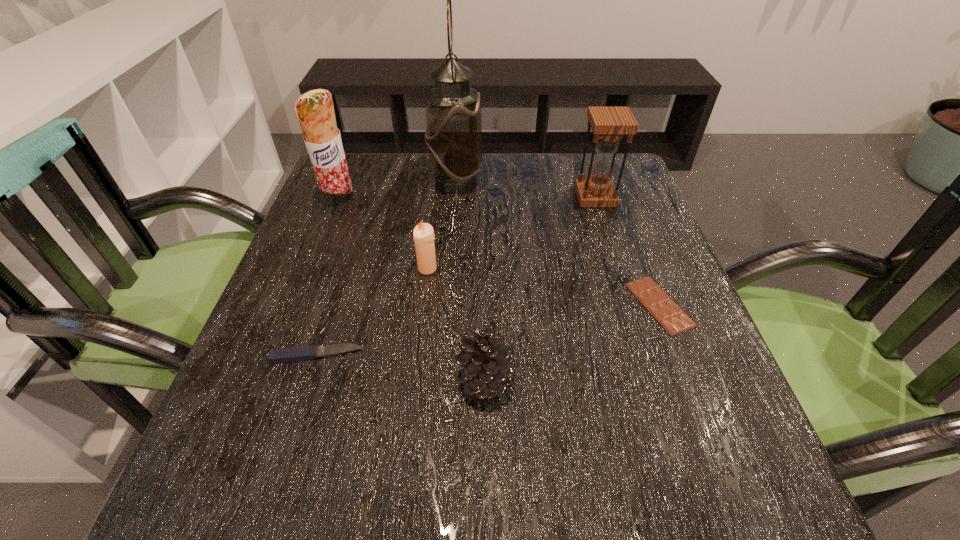
Locate an element on the screen. The image size is (960, 540). the closest object to the candle is located at coordinates (293, 354).

You are a GUI agent. You are given a task and a screenshot of the screen. Output one action in this format:
    pyautogui.click(x=<x>, y=<y>)
    Task: Click on the free spot that satisfies the following two spatial constraints: 1. on the back side of the chocolate bar; 2. on the left side of the pinecone
    The height and width of the screenshot is (540, 960).
    Given the screenshot: What is the action you would take?
    pyautogui.click(x=484, y=305)

In order to click on free space that satisfies the following two spatial constraints: 1. on the back side of the chocolate bar; 2. on the left side of the steak knife in this screenshot , I will do `click(332, 305)`.

Locate an element on the screen. vacant space that satisfies the following two spatial constraints: 1. on the back side of the fourth farthest object; 2. on the right side of the steak knife is located at coordinates (344, 268).